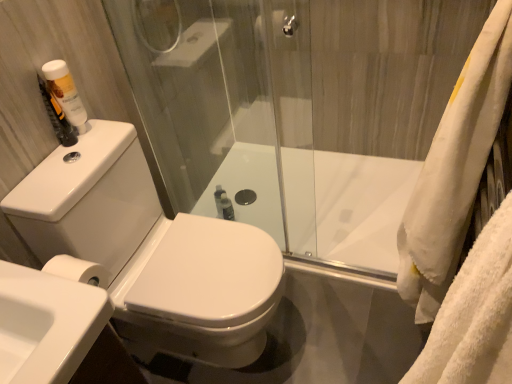
The height and width of the screenshot is (384, 512). I want to click on unoccupied space behind transparent glass shower door at upper right, so click(334, 225).